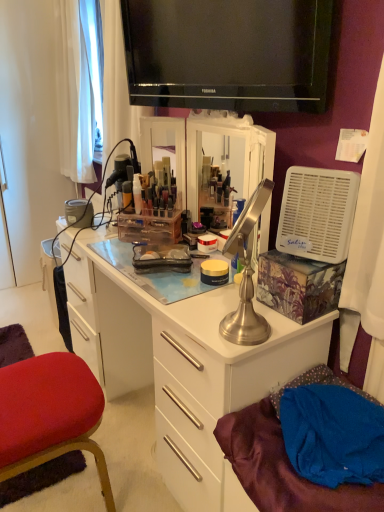
The width and height of the screenshot is (384, 512). Find the location of `empty space that is ontop of white plastic fan at right`. empty space that is ontop of white plastic fan at right is located at coordinates (326, 168).